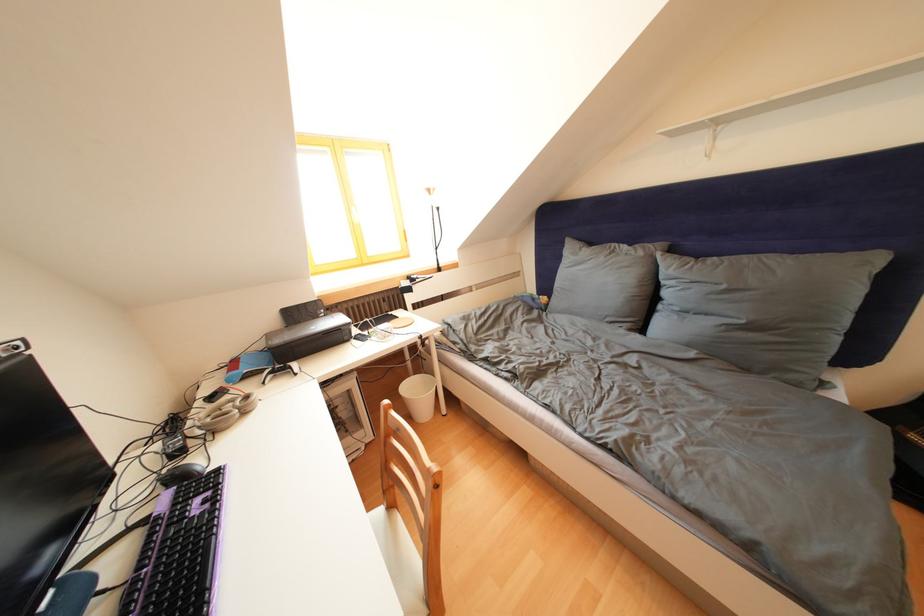
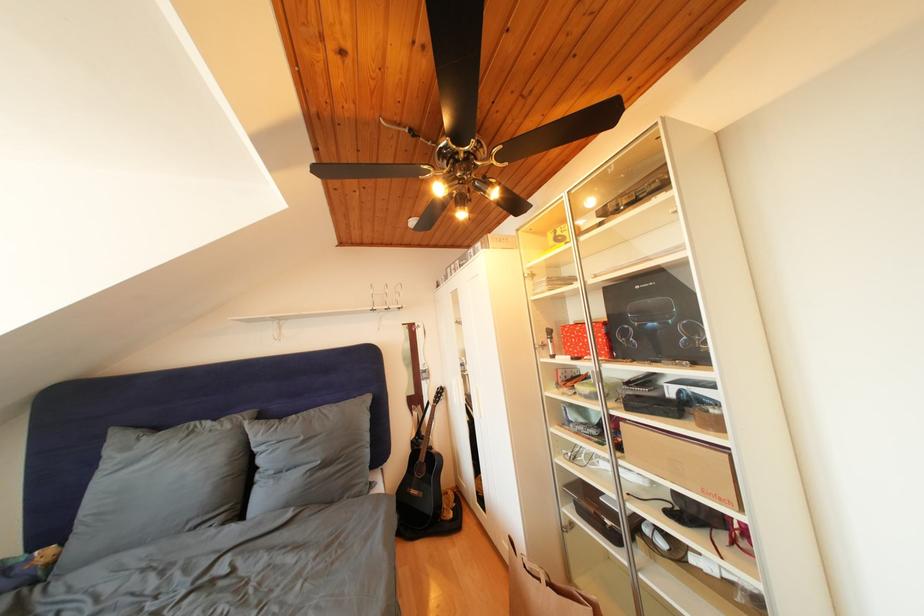
Find the pixel in the second image that matches point 733,292 in the first image.

(310, 444)